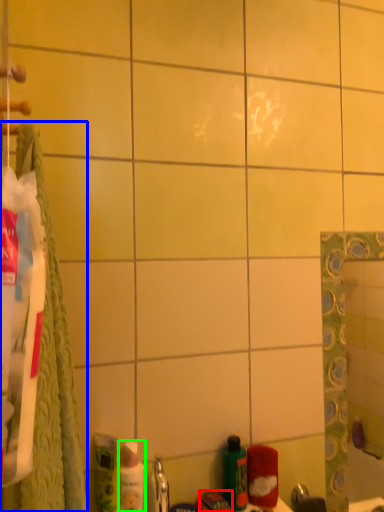
Question: Which is farther away from toothpaste (highlighted by a red box)? bath towel (highlighted by a blue box) or mouthwash (highlighted by a green box)?

Choices:
 (A) bath towel
 (B) mouthwash

Answer: (A)